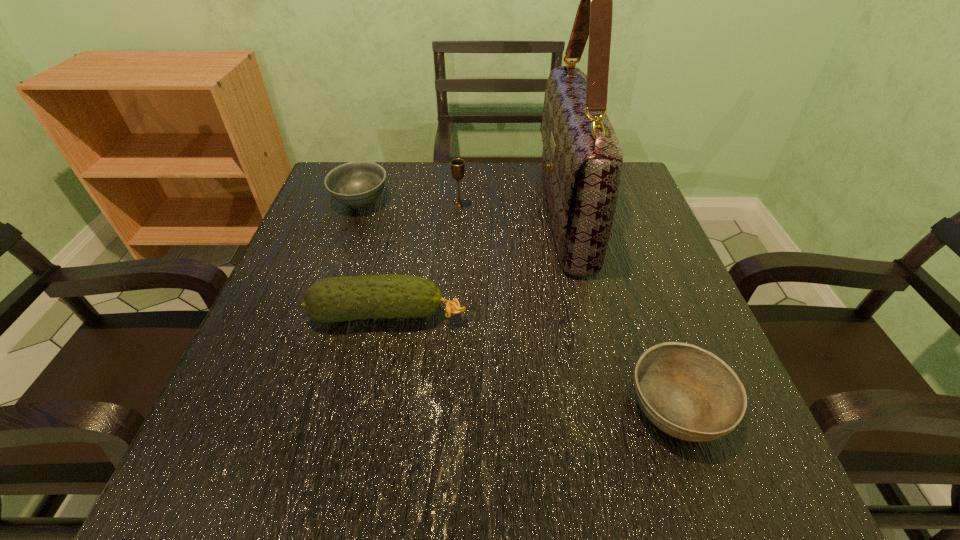
Where is `vacant space at the near left corner`? vacant space at the near left corner is located at coordinates (201, 501).

Where is `unoccupied position between the second tallest object and the handbag`? unoccupied position between the second tallest object and the handbag is located at coordinates (512, 210).

The image size is (960, 540). What are the coordinates of `free space between the nearest object and the handbag` in the screenshot? It's located at (621, 310).

At what (x,y) coordinates should I click in order to perform the action: click on vacant area that lies between the nearer bowl and the fourth farthest object. Please return your answer as a coordinate pair (x, y). This screenshot has width=960, height=540. Looking at the image, I should click on (533, 360).

Locate an element on the screen. This screenshot has height=540, width=960. vacant space in between the cucumber and the left bowl is located at coordinates (374, 258).

Locate an element on the screen. blank region between the second nearest object and the nearer bowl is located at coordinates (533, 360).

Identify the location of vacant area between the farther bowl and the handbag. (463, 207).

Locate an element on the screen. empty space between the nearer bowl and the chalice is located at coordinates (568, 306).

Identify the location of free space between the fourth shortest object and the left bowl. (410, 204).

Where is `unoccupied area between the right bowl and the second nearest object`? This screenshot has height=540, width=960. unoccupied area between the right bowl and the second nearest object is located at coordinates (533, 360).